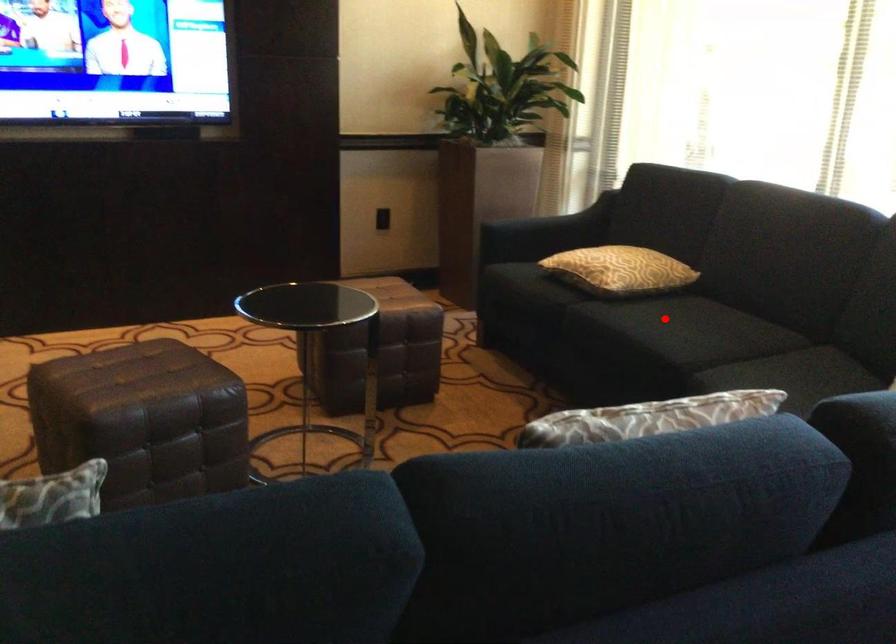
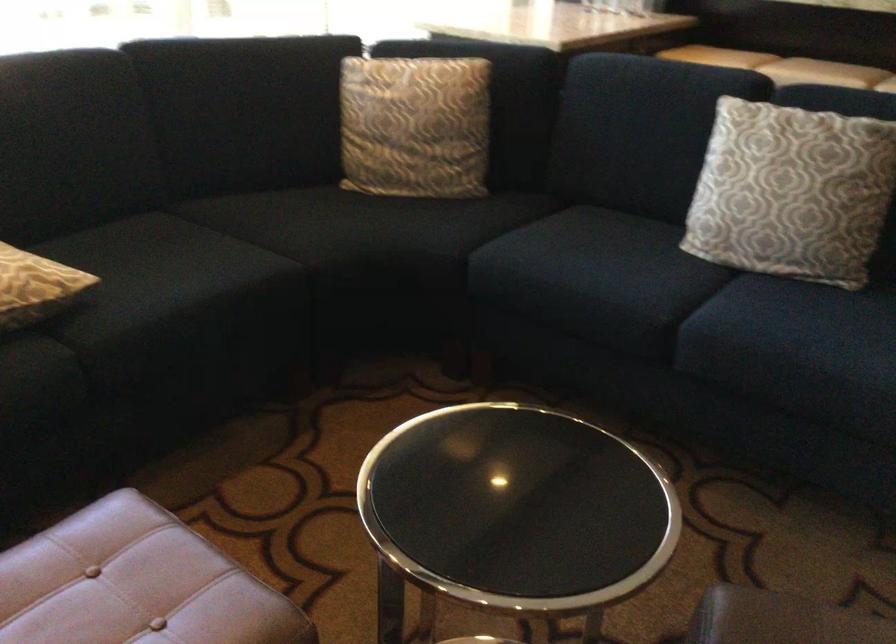
Question: I am providing you with two images of the same scene from different viewpoints. Image1 has a red point marked. In image2, the corresponding 3D location appears at what relative position? Reply with the corresponding letter.

Choices:
 (A) Closer
 (B) Farther

Answer: (A)